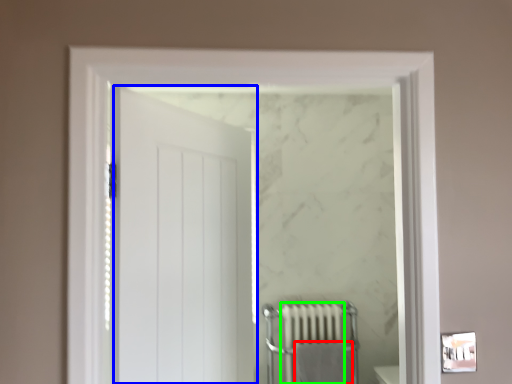
Question: Considering the real-world distances, which object is farthest from bath towel (highlighted by a red box)? door (highlighted by a blue box) or radiator (highlighted by a green box)?

Choices:
 (A) door
 (B) radiator

Answer: (A)